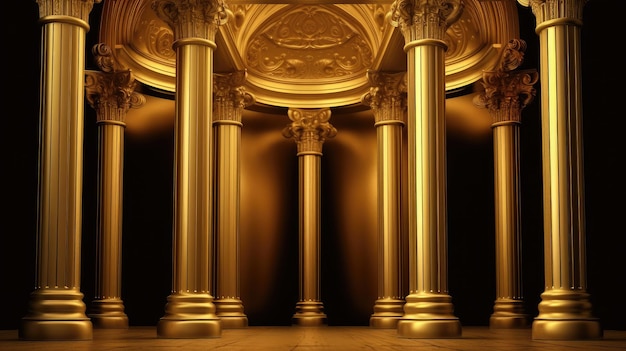
Image resolution: width=626 pixels, height=351 pixels. Identify the location of space between pillars. (606, 174), (531, 195), (471, 196), (356, 202), (272, 196), (151, 193), (96, 193).